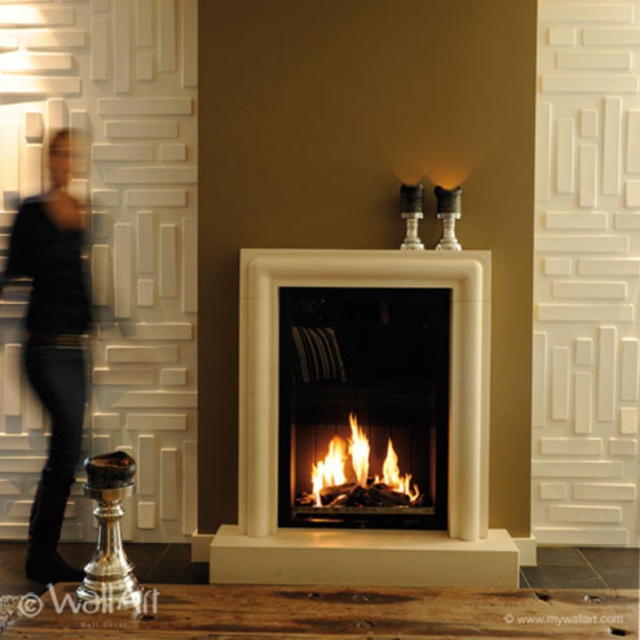
You are standing in the room and want to place a decorative item exactly at the center of the room. Given the white marble fireplace at center is located at point 0.680, 0.702, can you determine if the fireplace is positioned at the exact center of the room?

The white marble fireplace at center is located at point [449,435], which indicates it is positioned at the exact center of the room.

Based on the scene description, where is the point located at coordinates (x=449, y=435)?

The point at coordinates (x=449, y=435) corresponds to the white marble fireplace at center.

You are a photographer adjusting your camera settings in the room with the fireplace. You want to capture the black matte shirt at left and orange flame wood at center in focus. Which object should you focus on to ensure both are sharp?

You should focus on the orange flame wood at center because the black matte shirt at left is in front of it, so focusing on the background object would keep both in focus if they are within the depth of field.